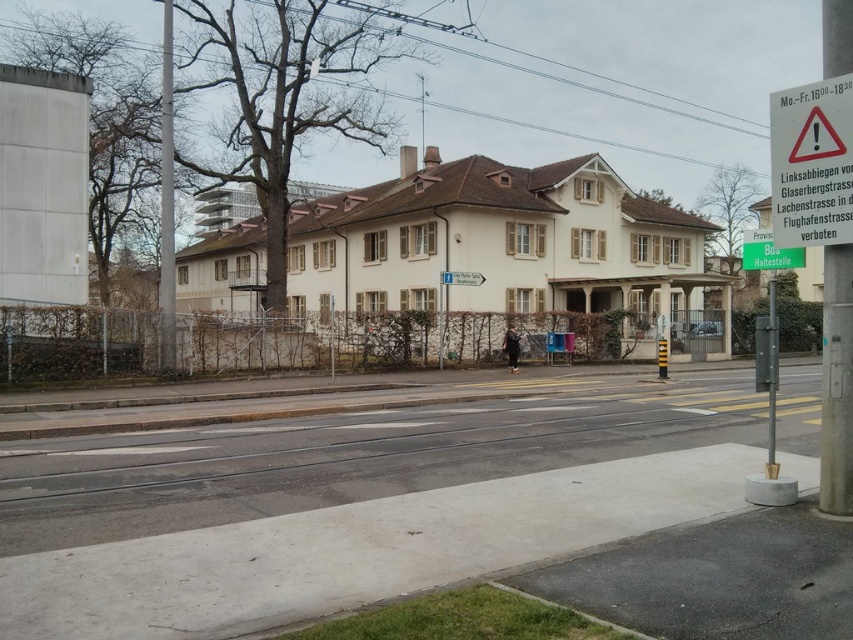
Question: Considering the relative positions of metallic pole at left and white plastic sign at upper center in the image provided, where is metallic pole at left located with respect to white plastic sign at upper center?

Choices:
 (A) right
 (B) left

Answer: (B)

Question: Is metallic pole at left to the right of white plastic sign at upper center from the viewer's perspective?

Choices:
 (A) no
 (B) yes

Answer: (A)

Question: Which point is farther to the camera?

Choices:
 (A) (444, 280)
 (B) (836, 93)

Answer: (A)

Question: Is white plastic sign at upper right wider than white plastic sign at upper center?

Choices:
 (A) yes
 (B) no

Answer: (A)

Question: Which point is farther from the camera taking this photo?

Choices:
 (A) (169, 17)
 (B) (463, 276)
 (C) (838, 138)

Answer: (B)

Question: Which object is the closest to the white plastic sign at upper right?

Choices:
 (A) white plastic sign at upper center
 (B) metallic pole at left

Answer: (A)